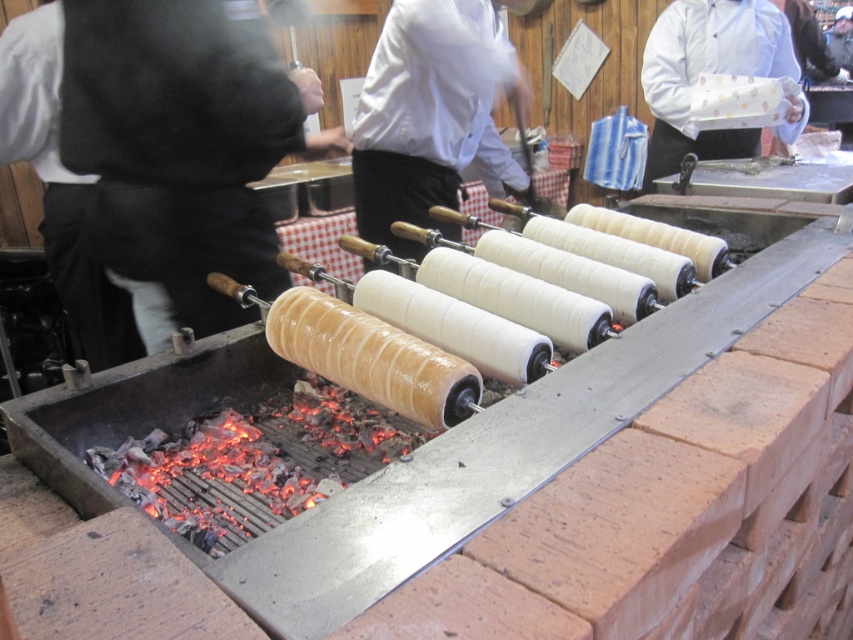
Between white glossy chef coat at center and charcoal-cooked dough at center, which one appears on the left side from the viewer's perspective?

Positioned to the left is charcoal-cooked dough at center.

Does white glossy chef coat at center appear on the right side of charcoal-cooked dough at center?

Correct, you'll find white glossy chef coat at center to the right of charcoal-cooked dough at center.

Is point (521, 170) positioned in front of point (309, 490)?

No, (521, 170) is further to viewer.

The height and width of the screenshot is (640, 853). Find the location of `white glossy chef coat at center`. white glossy chef coat at center is located at coordinates (431, 116).